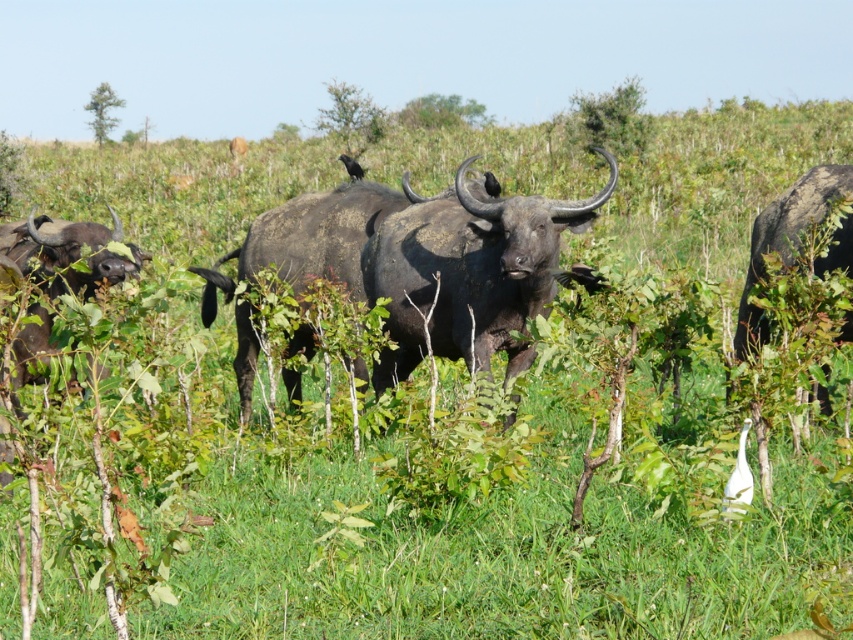
Image resolution: width=853 pixels, height=640 pixels. Describe the element at coordinates (468, 273) in the screenshot. I see `shiny dark brown bull at center` at that location.

Does shiny dark brown bull at center have a greater width compared to dark brown horned bull at right?

Yes.

Where is `shiny dark brown bull at center`? Image resolution: width=853 pixels, height=640 pixels. shiny dark brown bull at center is located at coordinates (468, 273).

Can you confirm if black matte yak at center is taller than dark brown horned bull at right?

Correct, black matte yak at center is much taller as dark brown horned bull at right.

Who is shorter, black matte yak at center or dark brown horned bull at right?

dark brown horned bull at right

At what (x,y) coordinates should I click in order to perform the action: click on black matte yak at center. Please return your answer as a coordinate pair (x, y). This screenshot has height=640, width=853. Looking at the image, I should click on (317, 234).

Image resolution: width=853 pixels, height=640 pixels. Identify the location of black matte yak at center. (317, 234).

Is point (451, 218) farther from camera compared to point (293, 378)?

No, it is in front of (293, 378).

Who is higher up, shiny dark brown bull at center or black matte yak at center?

shiny dark brown bull at center is higher up.

This screenshot has width=853, height=640. I want to click on shiny dark brown bull at center, so click(x=468, y=273).